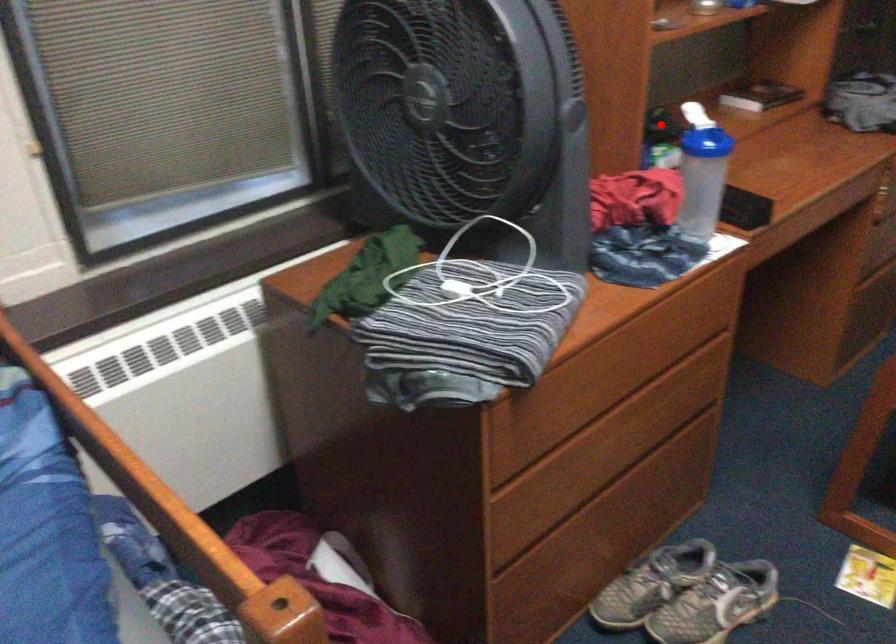
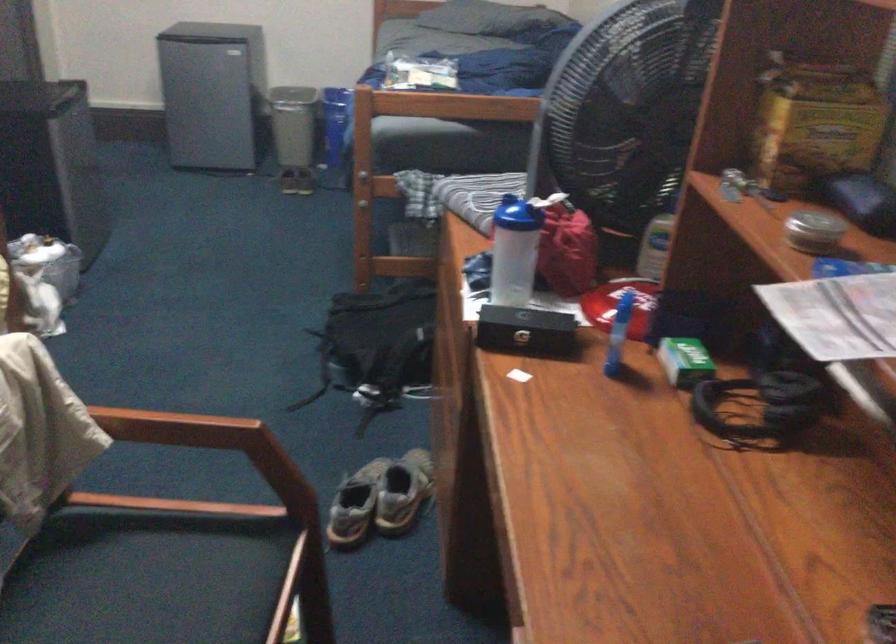
Question: I am providing you with two images of the same scene from different viewpoints. Image1 has a red point marked. In image2, the corresponding 3D location appears at what relative position? Reply with the corresponding letter.

Choices:
 (A) Closer
 (B) Farther

Answer: (A)